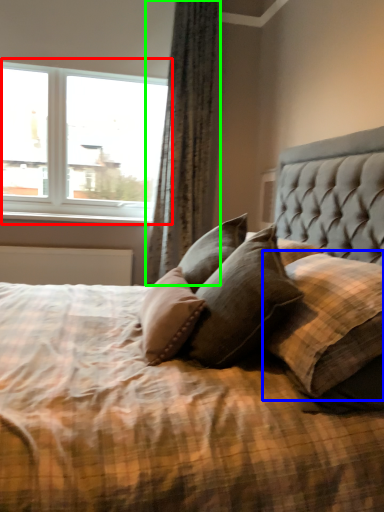
Question: Based on their relative distances, which object is farther from window (highlighted by a red box)? Choose from pillow (highlighted by a blue box) and curtain (highlighted by a green box).

Choices:
 (A) pillow
 (B) curtain

Answer: (A)